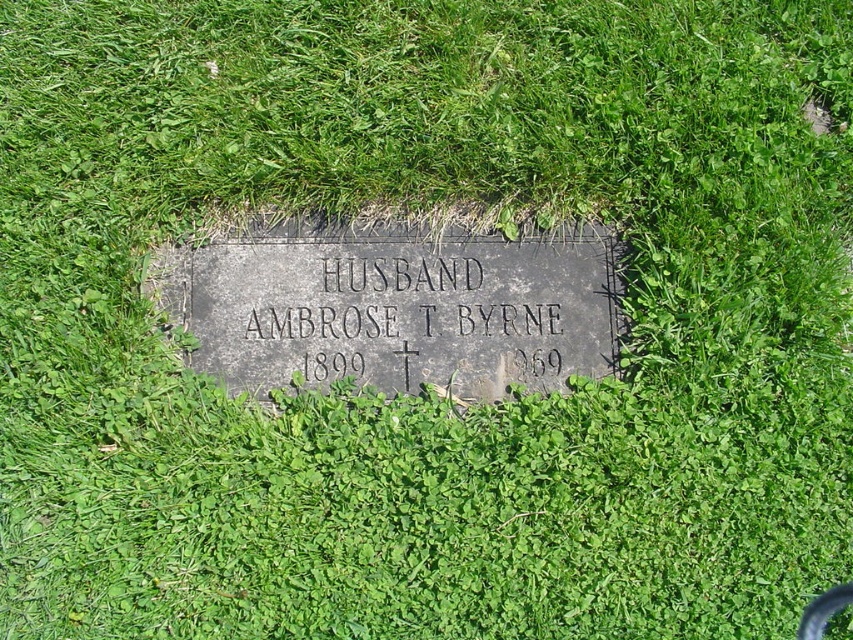
You are standing at the point marked by the coordinates (393, 308) in the image. Which object are you directly above?

You are directly above the dark gray stone plaque at center, which is represented by the point (393, 308).

You are a groundskeeper at a cemetery who needs to clean the dark gray stone plaque at center and the black stone plaque at center. Which plaque should you clean first if you want to start with the one that is above the other?

The dark gray stone plaque at center is positioned over the black stone plaque at center, so you should clean the dark gray stone plaque at center first.

You are standing in a cemetery and see two stone plaques. The dark gray stone plaque at center and the black stone plaque at center. Which one is closer to you?

The dark gray stone plaque at center is closer to you because it is in front of the black stone plaque at center.